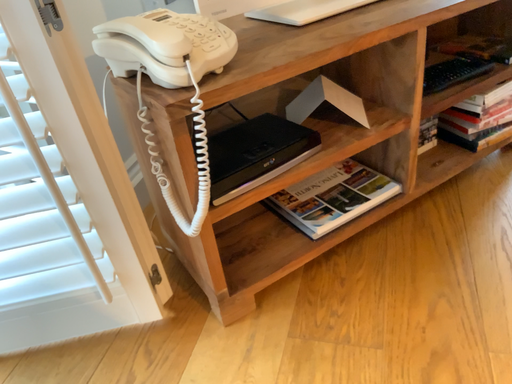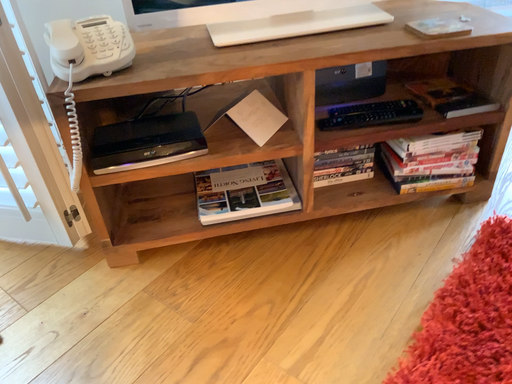
Question: Which way did the camera rotate in the video?

Choices:
 (A) rotated left
 (B) rotated right

Answer: (A)